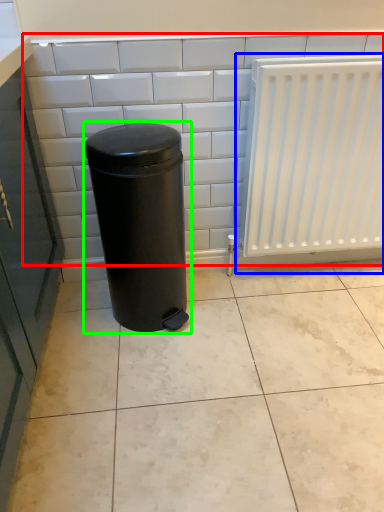
Question: Based on their relative distances, which object is farther from ceramic tile (highlighted by a red box)? Choose from radiator (highlighted by a blue box) and waste container (highlighted by a green box).

Choices:
 (A) radiator
 (B) waste container

Answer: (A)